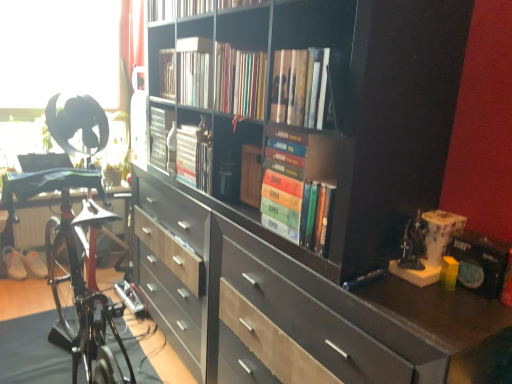
Question: Considering the relative sizes of white fabric shoe at lower left, arranged as the second footwear when viewed from the right, and hardcover books at center, acting as the second book starting from the front, in the image provided, is white fabric shoe at lower left, arranged as the second footwear when viewed from the right, bigger than hardcover books at center, acting as the second book starting from the front,?

Choices:
 (A) no
 (B) yes

Answer: (A)

Question: Is white fabric shoe at lower left, arranged as the second footwear when viewed from the right, closer to camera compared to hardcover books at center, the fourth book viewed from the back?

Choices:
 (A) yes
 (B) no

Answer: (B)

Question: From a real-world perspective, is white fabric shoe at lower left, acting as the 1th footwear starting from the left, over hardcover books at center, the fourth book viewed from the back?

Choices:
 (A) yes
 (B) no

Answer: (B)

Question: Does white fabric shoe at lower left, acting as the 1th footwear starting from the left, turn towards hardcover books at center, acting as the second book starting from the front?

Choices:
 (A) no
 (B) yes

Answer: (A)

Question: Is white fabric shoe at lower left, arranged as the second footwear when viewed from the right, directly adjacent to hardcover books at center, the fourth book viewed from the back?

Choices:
 (A) no
 (B) yes

Answer: (A)

Question: From their relative heights in the image, would you say hardcover books at center, which is the 3th book in front-to-back order, is taller or shorter than matte black paperback book at right?

Choices:
 (A) tall
 (B) short

Answer: (A)

Question: Relative to matte black paperback book at right, is hardcover books at center, which is the 3th book in front-to-back order, in front or behind?

Choices:
 (A) front
 (B) behind

Answer: (B)

Question: Is hardcover books at center, which is the 3th book in front-to-back order, wider or thinner than matte black paperback book at right?

Choices:
 (A) wide
 (B) thin

Answer: (A)

Question: From the image's perspective, is hardcover books at center, which ranks as the 3th book in back-to-front order, located above or below matte black paperback book at right?

Choices:
 (A) below
 (B) above

Answer: (B)

Question: Considering the positions of matte black bookcase at center and hardcover books at center, acting as the second book starting from the front, in the image, is matte black bookcase at center bigger or smaller than hardcover books at center, acting as the second book starting from the front,?

Choices:
 (A) small
 (B) big

Answer: (B)

Question: From the image's perspective, relative to hardcover books at center, the fourth book viewed from the back, is matte black bookcase at center above or below?

Choices:
 (A) above
 (B) below

Answer: (B)

Question: From a real-world perspective, is matte black bookcase at center physically located above or below hardcover books at center, acting as the second book starting from the front?

Choices:
 (A) above
 (B) below

Answer: (B)

Question: In terms of height, does matte black bookcase at center look taller or shorter compared to hardcover books at center, the fourth book viewed from the back?

Choices:
 (A) tall
 (B) short

Answer: (A)

Question: From the image's perspective, relative to hardcover books at center, which appears as the 5th book when viewed from the back, is matte black paperback book at right above or below?

Choices:
 (A) above
 (B) below

Answer: (B)

Question: Is matte black paperback book at right in front of or behind hardcover books at center, the 1th book when ordered from front to back, in the image?

Choices:
 (A) behind
 (B) front

Answer: (B)